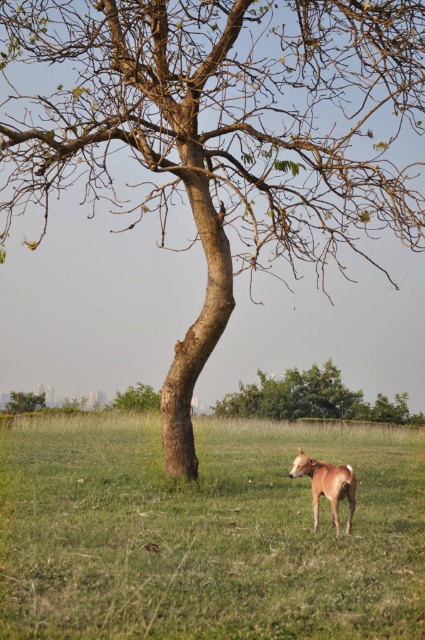
Question: Which object appears closest to the camera in this image?

Choices:
 (A) brown furry pony at lower center
 (B) green leafy tree at center
 (C) green leafy tree at upper left
 (D) brown fur dog at center

Answer: (D)

Question: Which point is farther to the camera?

Choices:
 (A) (11, 412)
 (B) (252, 413)

Answer: (B)

Question: Is green leafy tree at center wider than brown furry pony at lower center?

Choices:
 (A) yes
 (B) no

Answer: (A)

Question: Can you confirm if brown fur dog at center is smaller than brown furry pony at lower center?

Choices:
 (A) yes
 (B) no

Answer: (B)

Question: Is brown furry pony at lower center bigger than green leafy tree at upper left?

Choices:
 (A) no
 (B) yes

Answer: (A)

Question: Which point appears closest to the camera in this image?

Choices:
 (A) (405, 420)
 (B) (153, 461)
 (C) (28, 401)

Answer: (B)